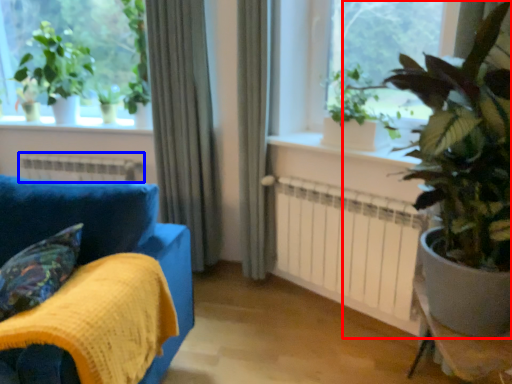
Question: Which of the following is the closest to the observer, houseplant (highlighted by a red box) or heater (highlighted by a blue box)?

Choices:
 (A) houseplant
 (B) heater

Answer: (A)